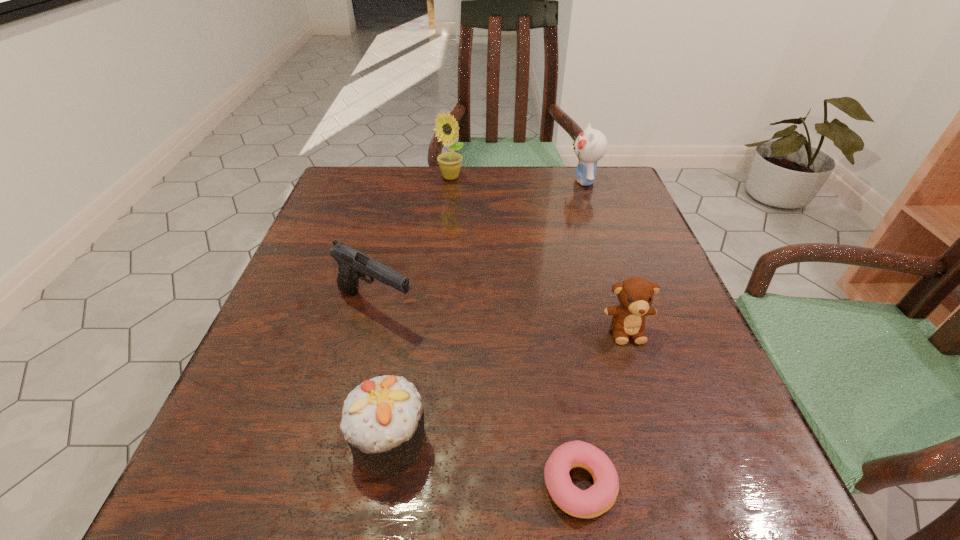
Locate an element on the screen. free space located 0.200m on the front-facing side of the kitten is located at coordinates (492, 181).

Where is `free space located 0.270m at the muzzle of the gun`? free space located 0.270m at the muzzle of the gun is located at coordinates (563, 306).

Locate an element on the screen. The height and width of the screenshot is (540, 960). free region located 0.270m on the face of the teddy bear is located at coordinates (685, 514).

What are the coordinates of `free space located 0.180m on the left of the cupcake` in the screenshot? It's located at (226, 441).

In order to click on vacant region located on the right of the third object from right to left in this screenshot , I will do `click(728, 484)`.

Find the location of a particular element. The height and width of the screenshot is (540, 960). sunflower that is at the far edge is located at coordinates (450, 162).

At what (x,y) coordinates should I click in order to perform the action: click on kitten at the far edge. Please return your answer as a coordinate pair (x, y). The image size is (960, 540). Looking at the image, I should click on (590, 146).

At what (x,y) coordinates should I click in order to perform the action: click on cupcake that is at the near edge. Please return your answer as a coordinate pair (x, y). This screenshot has height=540, width=960. Looking at the image, I should click on pos(382,420).

Identify the location of doughnut present at the near edge. The width and height of the screenshot is (960, 540). (600, 497).

This screenshot has width=960, height=540. Find the location of `object that is at the left edge`. object that is at the left edge is located at coordinates (353, 264).